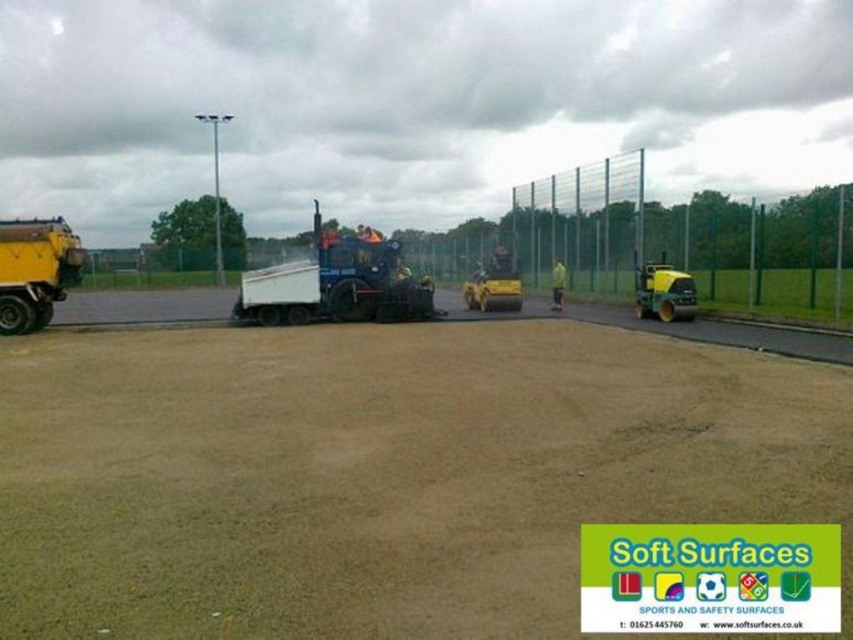
Is point (323, 316) farther from viewer compared to point (560, 284)?

No, it is in front of (560, 284).

What do you see at coordinates (335, 284) in the screenshot? I see `blue rubberized asphalt spreader at center` at bounding box center [335, 284].

Between point (393, 301) and point (558, 266), which one is positioned in front?

Point (393, 301)

The height and width of the screenshot is (640, 853). Identify the location of blue rubberized asphalt spreader at center. (335, 284).

Who is positioned more to the right, brown sandy dirt track at center or blue rubberized asphalt spreader at center?

Positioned to the right is brown sandy dirt track at center.

Is brown sandy dirt track at center wider than blue rubberized asphalt spreader at center?

In fact, brown sandy dirt track at center might be narrower than blue rubberized asphalt spreader at center.

Does point (363, 637) lie in front of point (364, 248)?

That is True.

Identify the location of brown sandy dirt track at center. (381, 474).

Looking at this image, which is more to the left, blue rubberized asphalt spreader at center or yellow rubber roller at center?

Positioned to the left is blue rubberized asphalt spreader at center.

Does point (289, 308) come in front of point (508, 304)?

Yes, it is in front of point (508, 304).

Locate an element on the screen. The width and height of the screenshot is (853, 640). blue rubberized asphalt spreader at center is located at coordinates (335, 284).